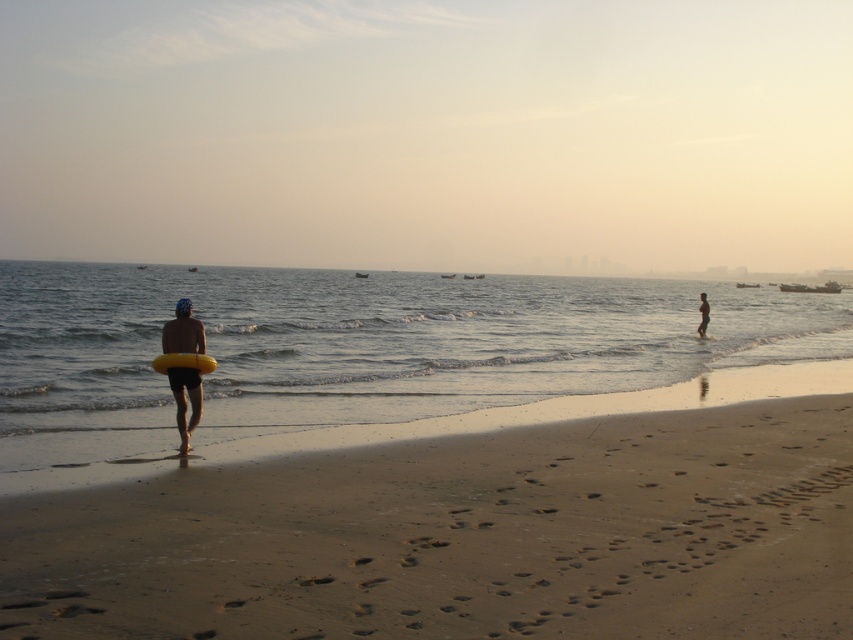
You are standing at point (704, 324) and want to walk to the shoreline. Is point (194, 353) located in front of you or behind you?

Point (194, 353) is in front of point (704, 324), so it is located in front of you.

You are planning to place a small sandcastle at the sandy yellow at lower left and the yellow rubber ring at center. Which location has a wider area to build the sandcastle?

The sandy yellow at lower left has a wider area than the yellow rubber ring at center, so it is better for building a sandcastle there.

You are a photographer trying to capture a wide shot of the beach scene. The yellow rubber ring at left and the smooth skin man at right are both in your frame. If you want to ensure both objects are fully visible without cropping, which object requires more horizontal space in the frame?

The yellow rubber ring at left requires more horizontal space in the frame because its width is larger than the smooth skin man at right.